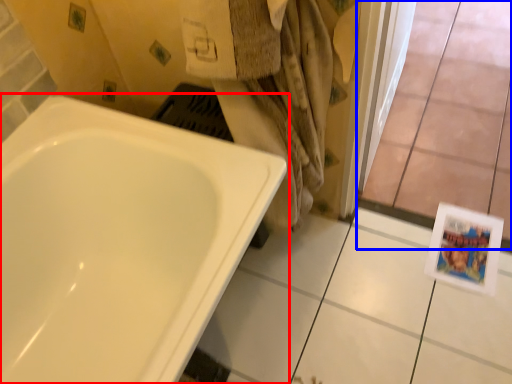
Question: Among these objects, which one is nearest to the camera, bathtub (highlighted by a red box) or glass door (highlighted by a blue box)?

Choices:
 (A) bathtub
 (B) glass door

Answer: (A)